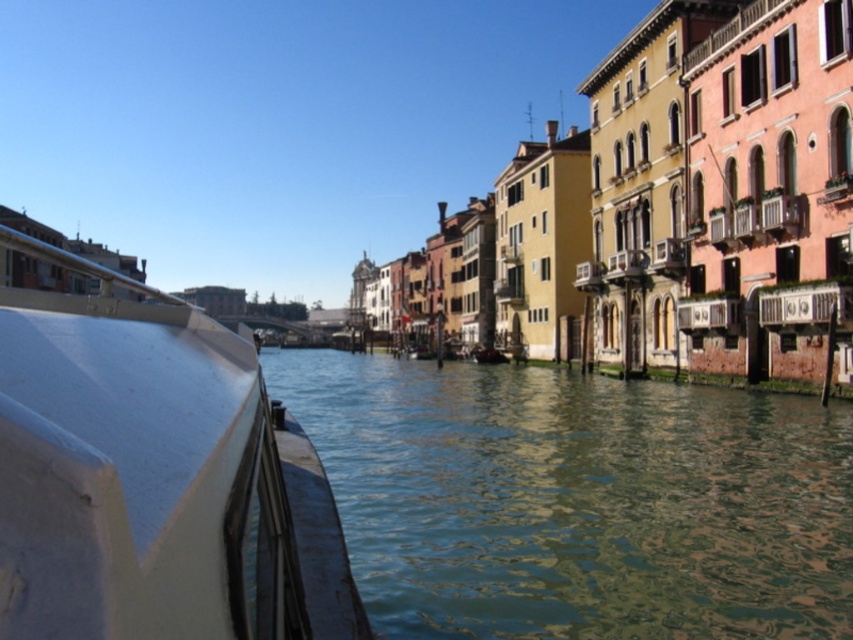
Is greenish water at center above white matte boat at left?

Result: Actually, greenish water at center is below white matte boat at left.

Which of these two, greenish water at center or white matte boat at left, stands taller?

white matte boat at left

Between point (401, 556) and point (71, 614), which one is positioned in front?

Point (71, 614) is in front.

This screenshot has width=853, height=640. Find the location of `greenish water at center`. greenish water at center is located at coordinates (577, 500).